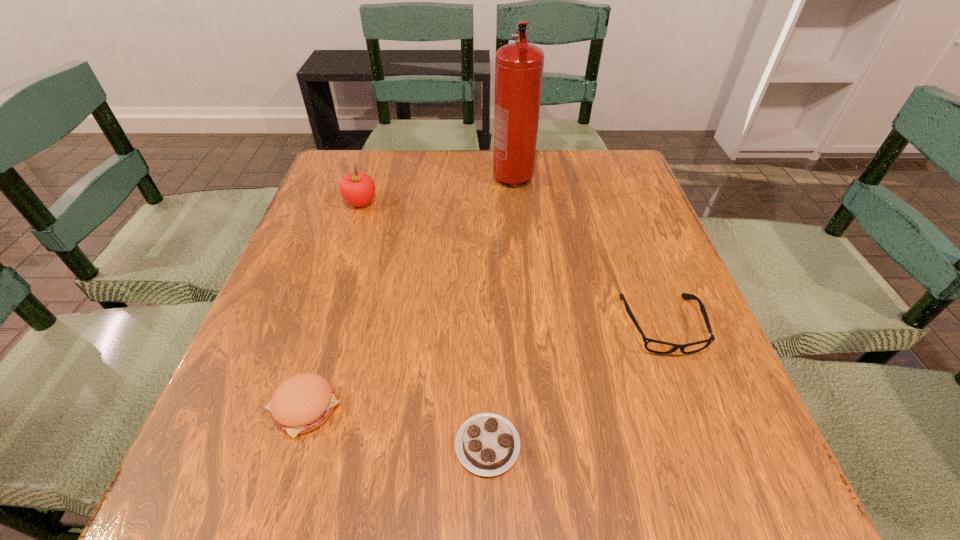
This screenshot has width=960, height=540. Find the location of `vacant point located 0.080m on the back of the shortest object`. vacant point located 0.080m on the back of the shortest object is located at coordinates (487, 373).

This screenshot has height=540, width=960. Find the location of `fire extinguisher present at the far edge`. fire extinguisher present at the far edge is located at coordinates (519, 66).

You are a GUI agent. You are given a task and a screenshot of the screen. Output one action in this format:
    pyautogui.click(x=<x>, y=<y>)
    Task: Click on the apple at the far edge
    The height and width of the screenshot is (540, 960).
    Given the screenshot: What is the action you would take?
    pyautogui.click(x=358, y=189)

I want to click on object that is positioned at the near edge, so click(x=487, y=444).

At what (x,y) coordinates should I click in order to perform the action: click on apple at the left edge. Please return your answer as a coordinate pair (x, y). Looking at the image, I should click on (358, 189).

I want to click on patty that is positioned at the left edge, so click(x=303, y=402).

The width and height of the screenshot is (960, 540). In order to click on object located in the right edge section of the desktop in this screenshot , I will do `click(655, 346)`.

The width and height of the screenshot is (960, 540). I want to click on object at the far left corner, so click(358, 189).

What are the coordinates of `vacant space at the far edge` in the screenshot? It's located at (490, 156).

What are the coordinates of `vacant area at the left edge` in the screenshot? It's located at (350, 235).